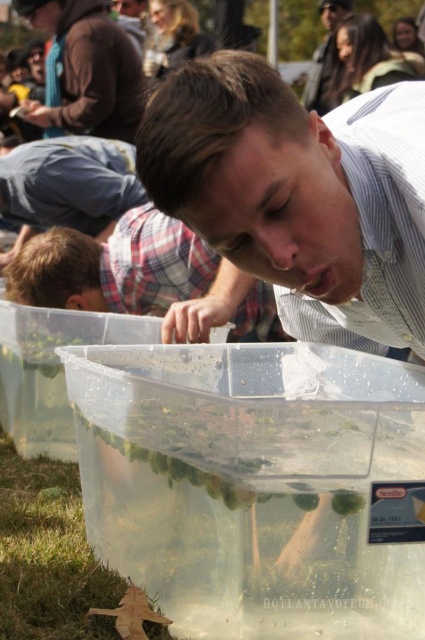
You are an observer at the scene. You see the plaid fabric shirt at center and the green leafy vegetable at lower center. Which object is larger in size?

The plaid fabric shirt at center is bigger than the green leafy vegetable at lower center according to the description.

You are a delivery person who needs to place a package between the plaid fabric shirt at center and the green leafy vegetable at lower center. The package is 3 feet long. Can you fit it between them without moving either object?

The distance between the plaid fabric shirt at center and the green leafy vegetable at lower center is 7.36 feet. Since the package is only 3 feet long, it can easily fit between them without needing to move either object.

In the scene shown: You are a photographer trying to capture the plaid fabric shirt at center and the green leafy vegetable at lower center in a single frame. Considering their sizes, which object should you focus on to ensure both fit clearly in the photo?

The plaid fabric shirt at center is wider than the green leafy vegetable at lower center, so you should focus on the plaid fabric shirt at center to ensure both fit clearly in the photo.